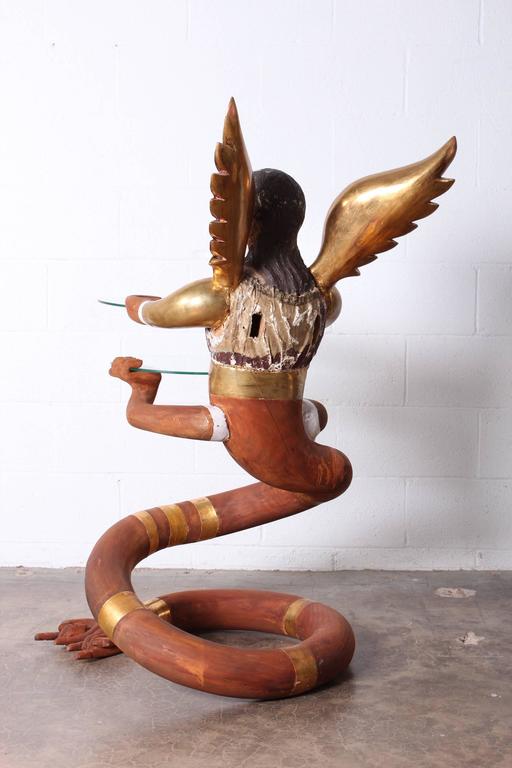
You are a GUI agent. You are given a task and a screenshot of the screen. Output one action in this format:
    pyautogui.click(x=<x>, y=<y>)
    Task: Click on the sculpture
    
    Given the screenshot: What is the action you would take?
    pyautogui.click(x=275, y=419)